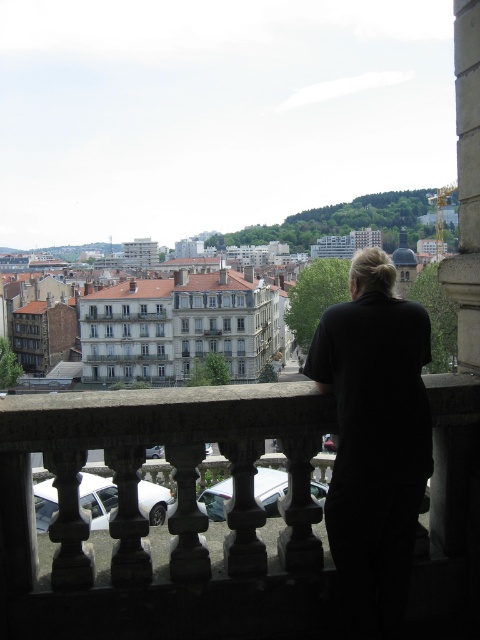
You are standing on the balcony and want to take a photo of the cityscape. The stone balustrade at center and the black fabric at center are in your way. Which object should you move to get a clear view?

The stone balustrade at center is in front of the black fabric at center, so you should move the stone balustrade at center to get a clear view.

From the picture: You are standing on the balcony and want to place a small potted plant exactly at the point labeled as point (x=168, y=518). Given that the stone balustrade at center is sturdy enough to hold the plant, where exactly should you place the plant?

You should place the small potted plant on the stone balustrade at center, as the point (x=168, y=518) is located there.